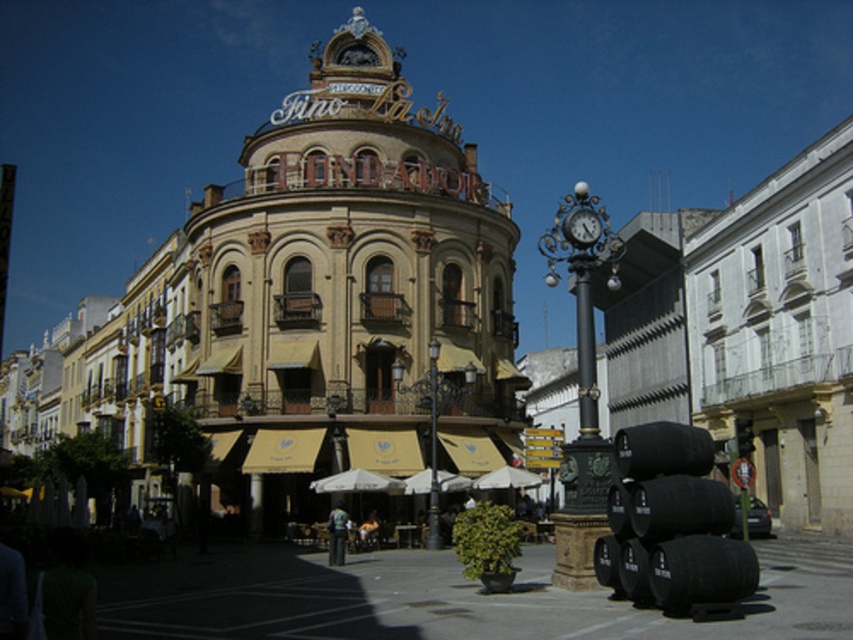
What is the purpose of the point at coordinates (351, 291) in the image?

The point at coordinates (351, 291) marks the location of the gold metallic sign at center.